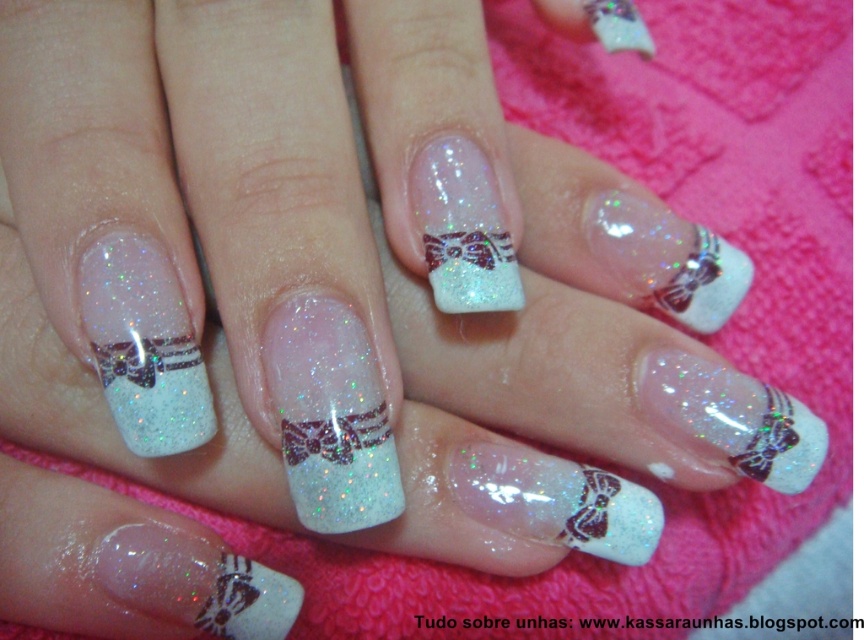
You are a nail technician assessing the design on a client. You notice the glittery white nail at center and the glittery metallic bow at center. Which object is placed on top of the other?

The glittery white nail at center is positioned over the glittery metallic bow at center, meaning it is placed on top of the bow.

You are a nail technician and need to apply a new design between the glittery white nail at center and the glittery metallic bow at center. The design requires a space of 10 centimeters. Can the space between them accommodate the design?

The space between the glittery white nail at center and the glittery metallic bow at center is only 9.58 centimeters, which is less than the required 10 centimeters. Therefore, the space is insufficient to accommodate the design.

Looking at this image, you are holding a small 1.5 inch wide decorative sticker that you want to place on the nails shown in the image. The sticker must be placed exactly at point (106, 336). Considering the distance between you and the point, will the sticker fit without overlapping any other part of the nail?

The point (106, 336) is 20.85 inches away from the viewer. Since the sticker is only 1.5 inches wide, there is enough space to place it without overlapping other parts of the nail.